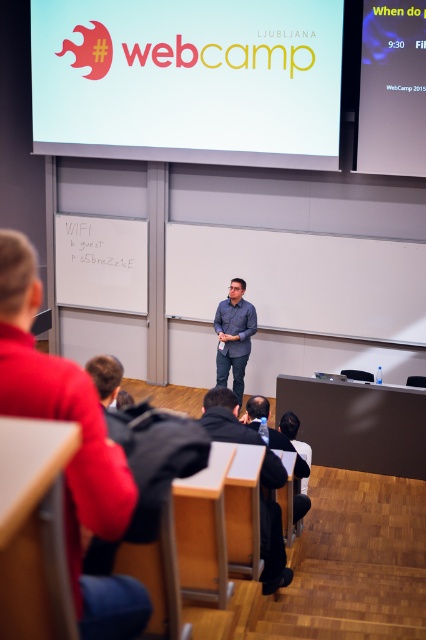
Question: Among these points, which one is farthest from the camera?

Choices:
 (A) (238, 362)
 (B) (244, 424)
 (C) (112, 532)

Answer: (A)

Question: Does black fabric jacket at lower center lie in front of blue shirt at center?

Choices:
 (A) no
 (B) yes

Answer: (B)

Question: Which object is closer to the camera taking this photo?

Choices:
 (A) white matte projection screen at upper center
 (B) blue shirt at center
 (C) dark gray shirt at center

Answer: (C)

Question: Is blue shirt at center positioned in front of dark gray shirt at center?

Choices:
 (A) no
 (B) yes

Answer: (A)

Question: Which of the following is the farthest from the observer?

Choices:
 (A) (132, 616)
 (B) (230, 412)
 (C) (233, 323)

Answer: (C)

Question: Is matte gray shirt at center above dark gray shirt at center?

Choices:
 (A) yes
 (B) no

Answer: (A)